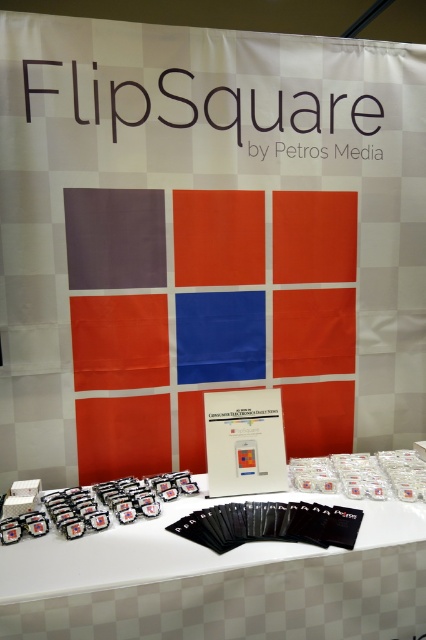
Question: Does white matte cards at center have a larger size compared to matte plastic cards at lower left?

Choices:
 (A) no
 (B) yes

Answer: (B)

Question: Among these objects, which one is farthest from the camera?

Choices:
 (A) matte plastic cards at lower left
 (B) white matte cards at center

Answer: (A)

Question: Is white matte cards at center smaller than matte plastic cards at lower left?

Choices:
 (A) no
 (B) yes

Answer: (A)

Question: Does white matte cards at center appear on the left side of matte plastic cards at lower left?

Choices:
 (A) no
 (B) yes

Answer: (A)